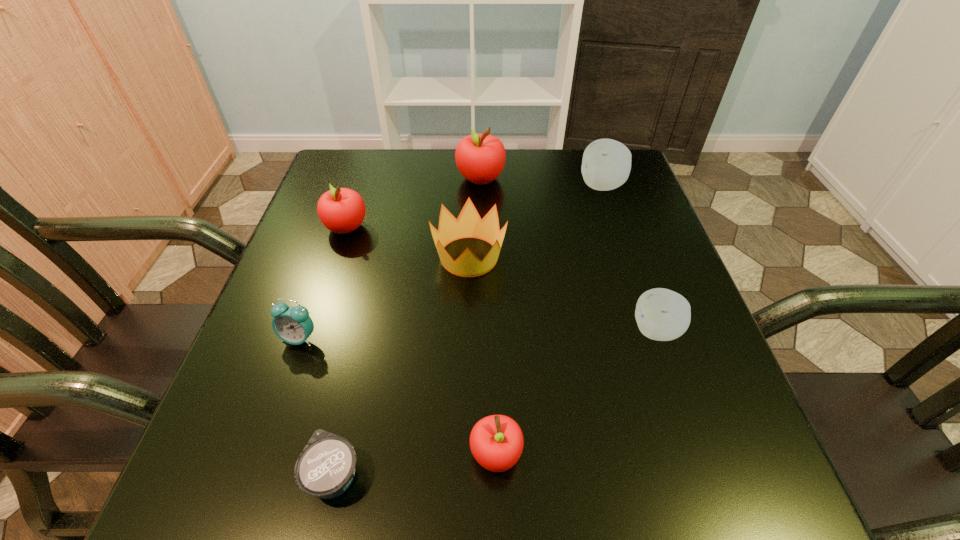
At what (x,y) coordinates should I click in order to perform the action: click on the tallest apple. Please return your answer as a coordinate pair (x, y). Looking at the image, I should click on (480, 158).

Locate an element on the screen. Image resolution: width=960 pixels, height=540 pixels. the biggest red apple is located at coordinates (480, 158).

Locate an element on the screen. the bigger white apple is located at coordinates (606, 164).

I want to click on the second nearest red apple, so click(341, 210).

Where is `the second biggest red apple`? the second biggest red apple is located at coordinates (341, 210).

This screenshot has width=960, height=540. In order to click on gold crown in this screenshot , I will do `click(469, 224)`.

Identify the location of alarm clock. This screenshot has width=960, height=540. (293, 325).

You are a GUI agent. You are given a task and a screenshot of the screen. Output one action in this format:
    pyautogui.click(x=<x>, y=<y>)
    Task: Click on the smaller white apple
    This screenshot has height=540, width=960.
    Given the screenshot: What is the action you would take?
    pyautogui.click(x=661, y=314)

This screenshot has width=960, height=540. In order to click on the second nearest apple in this screenshot , I will do `click(661, 314)`.

Identify the location of the nearest apple. (496, 442).